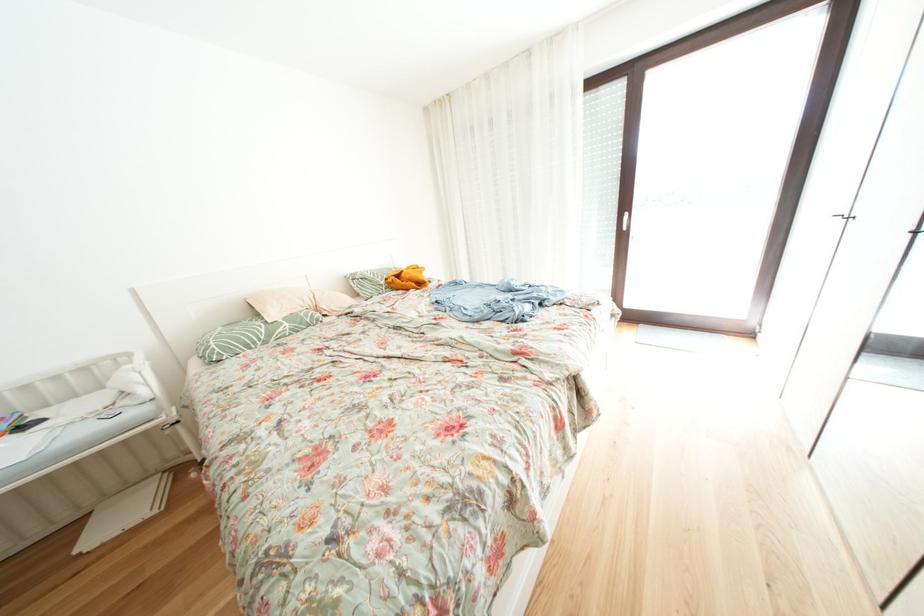
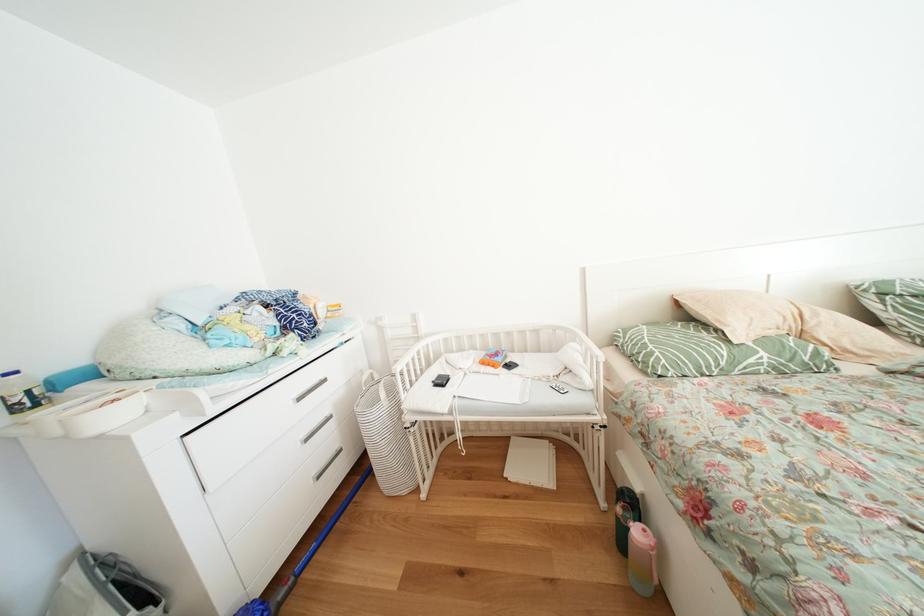
In the second image, find the point that corresponds to point (203, 480) in the first image.

(628, 515)